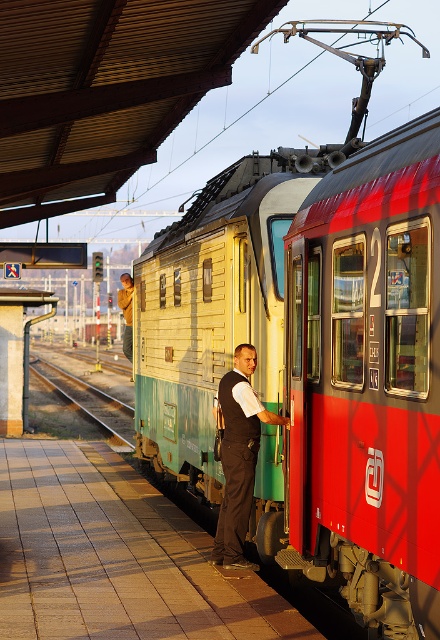
Question: Estimate the real-world distances between objects in this image. Which object is farther from the metal train track at center?

Choices:
 (A) black vest at center
 (B) brown tile platform at lower left

Answer: (A)

Question: Where is metal train track at center located in relation to light brown leather vest at center in the image?

Choices:
 (A) below
 (B) above

Answer: (A)

Question: Can you confirm if metal train track at center is bigger than light brown leather vest at center?

Choices:
 (A) no
 (B) yes

Answer: (A)

Question: Considering the real-world distances, which object is farthest from the metal train track at center?

Choices:
 (A) light brown leather vest at center
 (B) black vest at center

Answer: (B)

Question: Which of these objects is positioned farthest from the metallic yellow-green train at center?

Choices:
 (A) black vest at center
 (B) light brown leather vest at center
 (C) brown tile platform at lower left
 (D) metal train track at center

Answer: (D)

Question: Observing the image, what is the correct spatial positioning of brown tile platform at lower left in reference to light brown leather vest at center?

Choices:
 (A) below
 (B) above

Answer: (A)